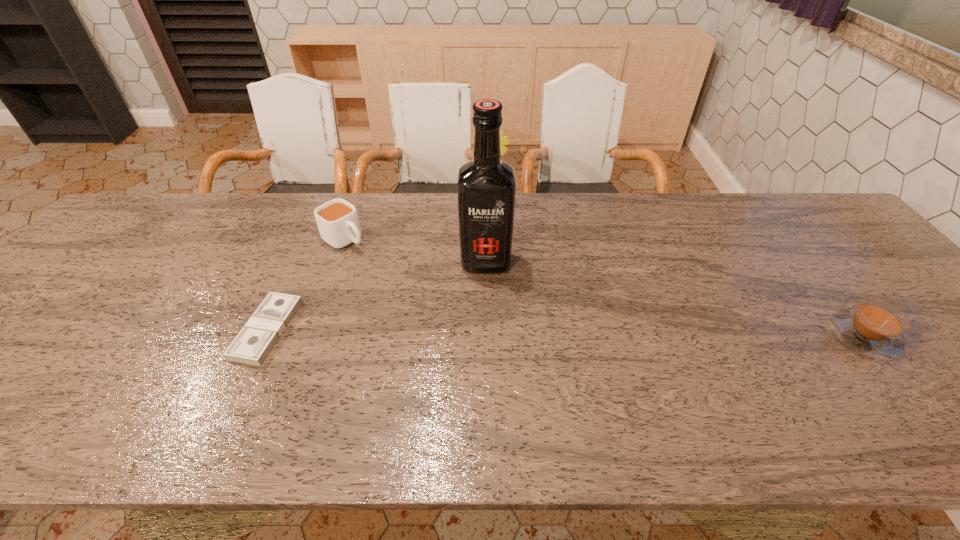
Identify the location of free space on the desktop that is between the dollar and the rightmost object and is positioned on the front-facing side of the sunflower. (542, 333).

This screenshot has width=960, height=540. I want to click on vacant space on the desktop that is between the shortest object and the second shortest object and is positioned on the front-facing side of the tallest object, so click(486, 332).

Locate an element on the screen. The width and height of the screenshot is (960, 540). free space on the desktop that is between the shortest object and the fourth tallest object and is positioned on the side with the handle of the cup is located at coordinates [475, 332].